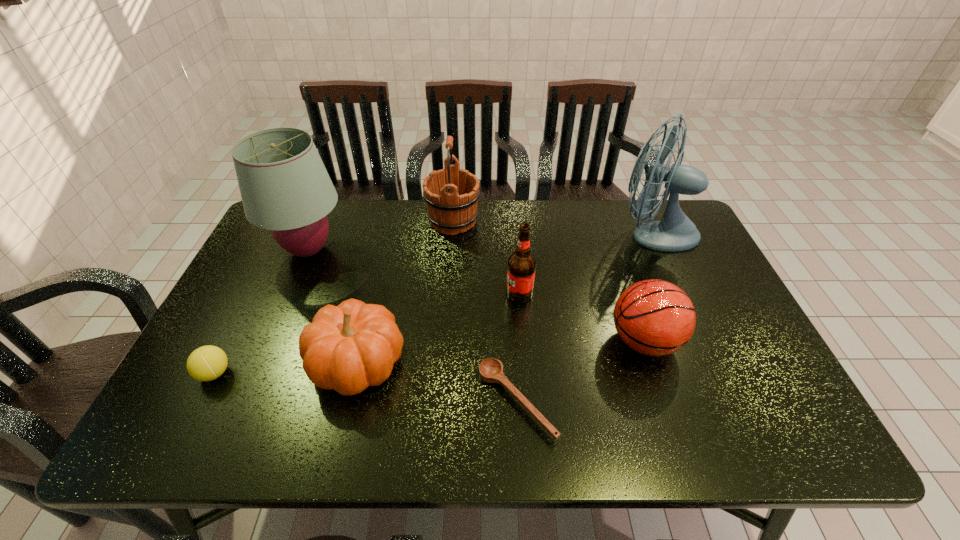
Where is `free spot at the far edge of the desktop`? This screenshot has height=540, width=960. free spot at the far edge of the desktop is located at coordinates (376, 224).

In the image, there is a desktop. At what (x,y) coordinates should I click in order to perform the action: click on vacant space at the near edge. Please return your answer as a coordinate pair (x, y). The image size is (960, 540). Looking at the image, I should click on (527, 442).

The width and height of the screenshot is (960, 540). In order to click on vacant space at the left edge of the desktop in this screenshot , I will do `click(275, 303)`.

What are the coordinates of `free region at the near left corner of the desktop` in the screenshot? It's located at (200, 423).

Locate an element on the screen. This screenshot has width=960, height=540. free area in between the pumpkin and the fan is located at coordinates (505, 298).

I want to click on free area in between the fan and the second shortest object, so click(434, 303).

Locate an element on the screen. vacant area that lies between the lampshade and the tennis ball is located at coordinates (261, 312).

Locate an element on the screen. The height and width of the screenshot is (540, 960). unoccupied area between the tennis ball and the pumpkin is located at coordinates (286, 368).

You are a GUI agent. You are given a task and a screenshot of the screen. Output one action in this format:
    pyautogui.click(x=<x>, y=<y>)
    Task: Click on the free space between the basketball and the wine bucket
    The height and width of the screenshot is (540, 960).
    Given the screenshot: What is the action you would take?
    pyautogui.click(x=548, y=281)

The height and width of the screenshot is (540, 960). I want to click on free area in between the basketball and the pumpkin, so pos(501,352).